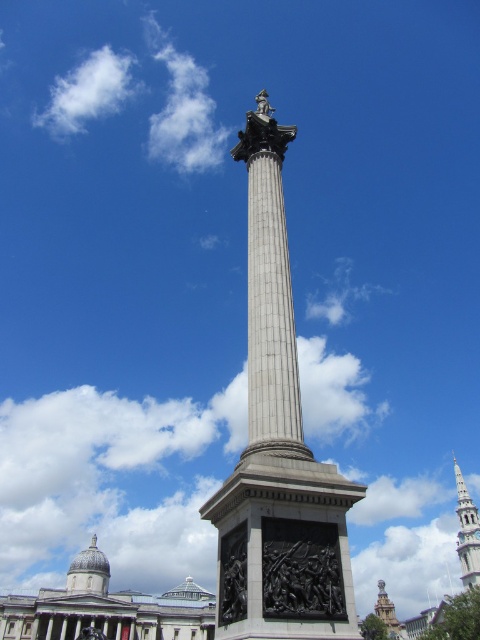
Question: Among these objects, which one is farthest from the camera?

Choices:
 (A) white fluffy cloud at upper left
 (B) gold textured tower at center

Answer: (A)

Question: Is polished bronze statue at center smaller than white stone spire at right?

Choices:
 (A) yes
 (B) no

Answer: (A)

Question: Estimate the real-world distances between objects in this image. Which object is closer to the black polished bronze bas-relief at center?

Choices:
 (A) polished bronze statue at center
 (B) gold textured tower at center
 (C) white stone spire at right

Answer: (A)

Question: Can you confirm if polished bronze statue at center is bigger than gold textured tower at center?

Choices:
 (A) yes
 (B) no

Answer: (B)

Question: Which point is farther to the camera?

Choices:
 (A) gold textured tower at center
 (B) polished bronze statue at center
 (C) white stone spire at right
 (D) white fluffy cloud at upper left

Answer: (D)

Question: Where is black polished bronze bas-relief at center located in relation to white fluffy cloud at upper left in the image?

Choices:
 (A) left
 (B) right

Answer: (B)